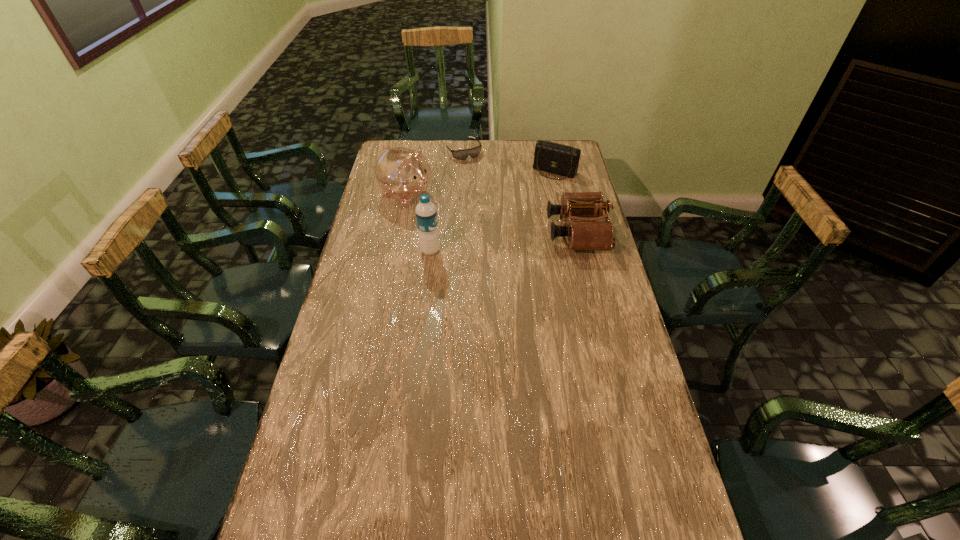
Where is `vacant area located 0.110m on the front flap of the clutch bag`? vacant area located 0.110m on the front flap of the clutch bag is located at coordinates (539, 193).

Locate an element on the screen. vacant region located 0.120m on the front flap of the clutch bag is located at coordinates 538,194.

Locate an element on the screen. The width and height of the screenshot is (960, 540). free point located 0.110m on the front flap of the clutch bag is located at coordinates (539, 193).

Find the location of a particular element. This screenshot has height=540, width=960. vacant space located on the front facing side of the piggy bank is located at coordinates (468, 226).

The height and width of the screenshot is (540, 960). Find the location of `free space located 0.210m on the front facing side of the piggy bank`. free space located 0.210m on the front facing side of the piggy bank is located at coordinates (466, 225).

At what (x,y) coordinates should I click in order to perform the action: click on free region located on the front facing side of the piggy bank. Please return your answer as a coordinate pair (x, y). The height and width of the screenshot is (540, 960). Looking at the image, I should click on (450, 217).

The image size is (960, 540). What are the coordinates of `vacant space located on the lenses of the goggles` in the screenshot? It's located at (483, 180).

In order to click on free point located on the lenses of the goggles in this screenshot , I will do `click(503, 208)`.

The height and width of the screenshot is (540, 960). I want to click on blank area located 0.370m on the lenses of the goggles, so click(x=501, y=206).

Identify the location of clutch bag that is at the far edge. (551, 157).